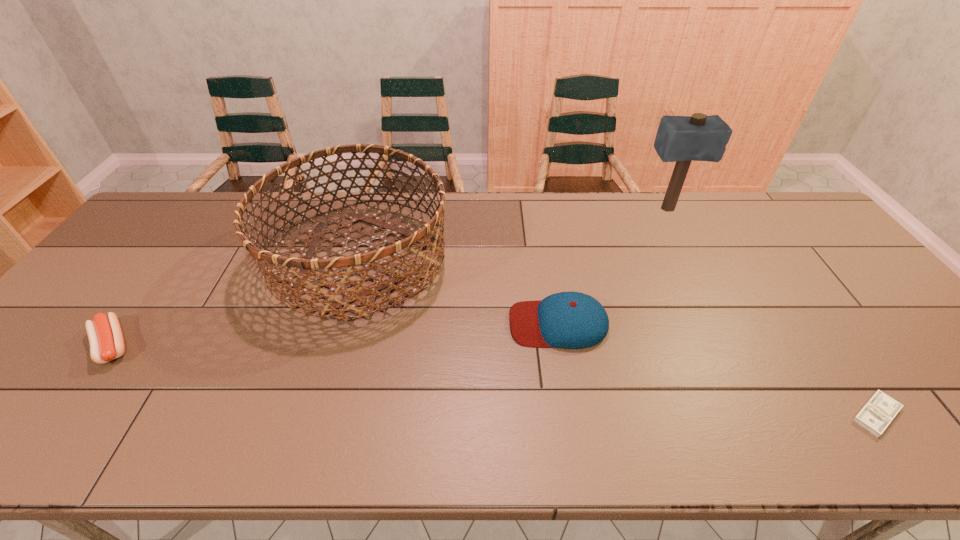
Where is `blank area in the image that satisfies the following two spatial constraints: 1. with the bill of the third object from left to right facing forward; 2. on the back side of the shortest object`? blank area in the image that satisfies the following two spatial constraints: 1. with the bill of the third object from left to right facing forward; 2. on the back side of the shortest object is located at coordinates (573, 415).

Locate an element on the screen. This screenshot has width=960, height=540. free space in the image that satisfies the following two spatial constraints: 1. with the bill of the baseball cap facing forward; 2. on the front side of the sausage is located at coordinates (562, 345).